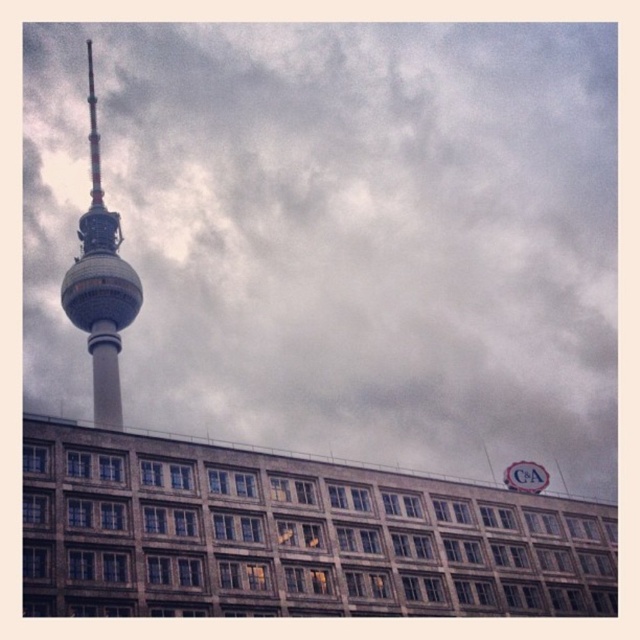
Question: Among these objects, which one is nearest to the camera?

Choices:
 (A) cloudy gray sky at upper center
 (B) metallic silver tower at left

Answer: (B)

Question: Is cloudy gray sky at upper center smaller than metallic silver tower at left?

Choices:
 (A) yes
 (B) no

Answer: (B)

Question: Which point is closer to the camera?

Choices:
 (A) cloudy gray sky at upper center
 (B) metallic silver tower at left

Answer: (B)

Question: Which object is farther from the camera taking this photo?

Choices:
 (A) cloudy gray sky at upper center
 (B) metallic silver tower at left

Answer: (A)

Question: Is cloudy gray sky at upper center closer to camera compared to metallic silver tower at left?

Choices:
 (A) yes
 (B) no

Answer: (B)

Question: Considering the relative positions of cloudy gray sky at upper center and metallic silver tower at left in the image provided, where is cloudy gray sky at upper center located with respect to metallic silver tower at left?

Choices:
 (A) above
 (B) below

Answer: (A)